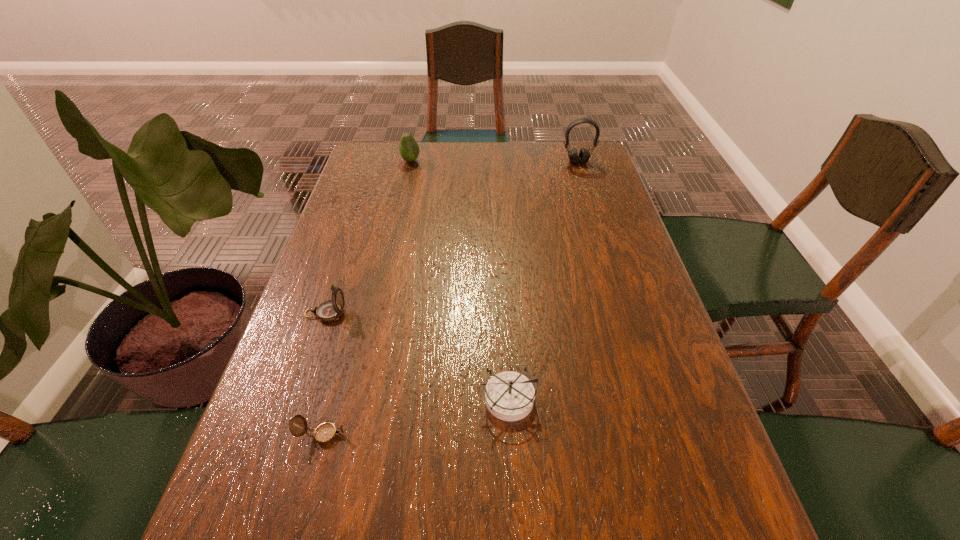
Identify the location of vacant area in the image that satisfies the following two spatial constraints: 1. on the face of the fourth object from left to right; 2. on the left side of the farthest compass. This screenshot has height=540, width=960. (298, 399).

Image resolution: width=960 pixels, height=540 pixels. Find the location of `free space that satisfies the following two spatial constraints: 1. on the front-facing side of the rightmost object; 2. on the face of the third farthest object`. free space that satisfies the following two spatial constraints: 1. on the front-facing side of the rightmost object; 2. on the face of the third farthest object is located at coordinates (625, 313).

At what (x,y) coordinates should I click in order to perform the action: click on free space that satisfies the following two spatial constraints: 1. on the front side of the rightmost compass; 2. on the face of the shortest compass. Please return your answer as a coordinate pair (x, y). The image size is (960, 540). Looking at the image, I should click on (510, 435).

Find the location of a particular element. Image resolution: width=960 pixels, height=540 pixels. vacant point that satisfies the following two spatial constraints: 1. on the face of the farthest compass; 2. on the left side of the second tallest compass is located at coordinates (298, 399).

Locate an element on the screen. This screenshot has width=960, height=540. free space that satisfies the following two spatial constraints: 1. on the front-facing side of the headset; 2. on the face of the nearest object is located at coordinates (663, 435).